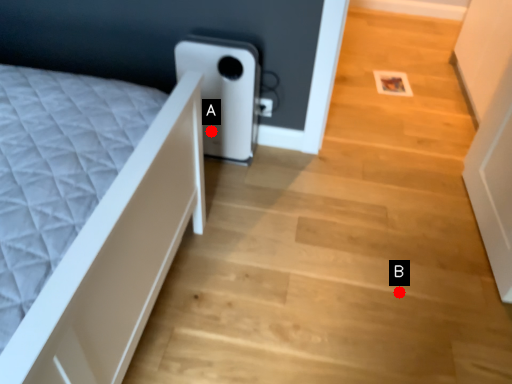
Question: Two points are circled on the image, labeled by A and B beside each circle. Which of the following is the closest to the observer?

Choices:
 (A) A is closer
 (B) B is closer

Answer: (B)